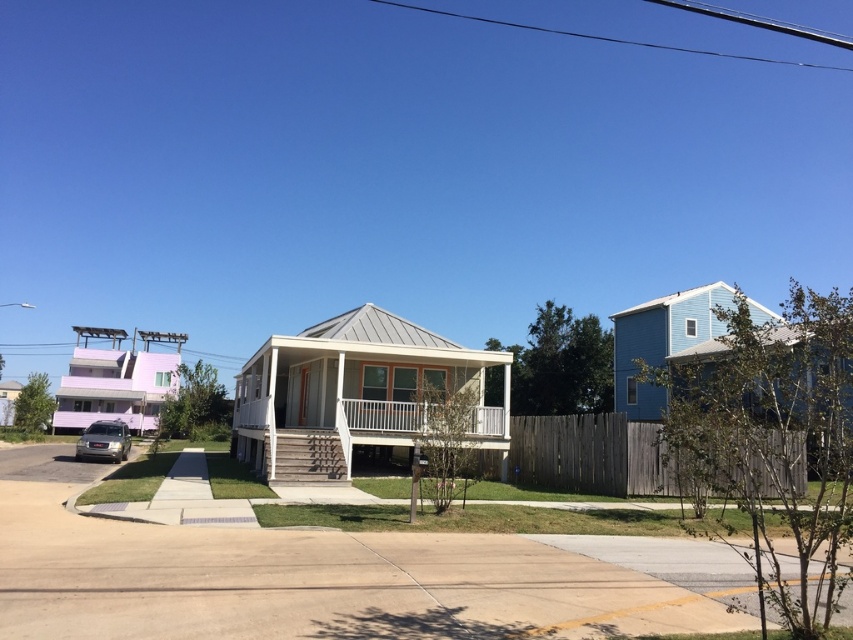
Question: Is white metal porch at center above satin silver suv at lower left?

Choices:
 (A) no
 (B) yes

Answer: (B)

Question: Which point is farther from the camera taking this photo?

Choices:
 (A) (489, 413)
 (B) (80, 456)

Answer: (B)

Question: Which point is closer to the camera?

Choices:
 (A) satin silver suv at lower left
 (B) white metal porch at center

Answer: (B)

Question: From the image, what is the correct spatial relationship of white metal porch at center in relation to satin silver suv at lower left?

Choices:
 (A) left
 (B) right

Answer: (B)

Question: Can you confirm if white metal porch at center is positioned to the left of satin silver suv at lower left?

Choices:
 (A) no
 (B) yes

Answer: (A)